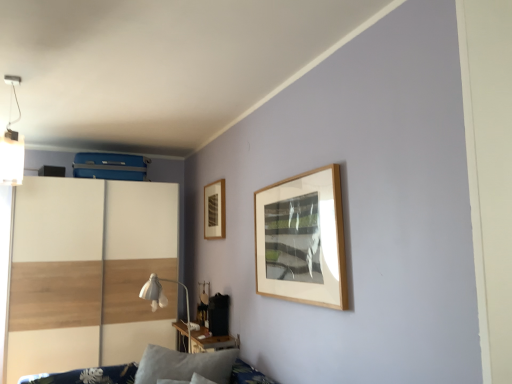
Question: From their relative heights in the image, would you say white fabric table lamp at center is taller or shorter than blue fabric sofa at lower left?

Choices:
 (A) tall
 (B) short

Answer: (A)

Question: From the image's perspective, relative to blue fabric sofa at lower left, is white fabric table lamp at center above or below?

Choices:
 (A) below
 (B) above

Answer: (B)

Question: Which of these objects is positioned closest to the white matte light fixture at upper left?

Choices:
 (A) blue fabric sofa at lower left
 (B) wooden table at lower center
 (C) white wood dresser at left
 (D) gray fabric pillow at lower left
 (E) wooden picture frame at upper left

Answer: (C)

Question: Which is nearer to the white wood dresser at left?

Choices:
 (A) gray fabric pillow at lower left
 (B) blue fabric sofa at lower left
 (C) white fabric table lamp at center
 (D) wooden table at lower center
 (E) wooden picture frame at upper left

Answer: (B)